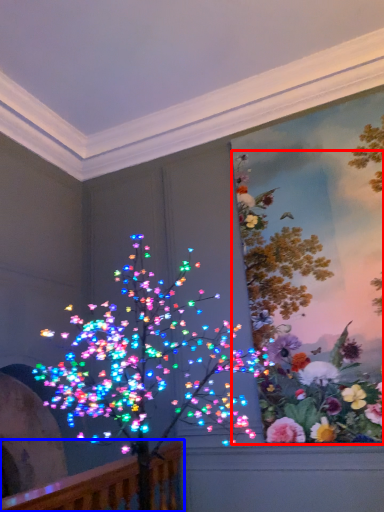
Question: Which point is closer to the camera, floral arrangement (highlighted by a red box) or rail (highlighted by a blue box)?

Choices:
 (A) floral arrangement
 (B) rail

Answer: (B)